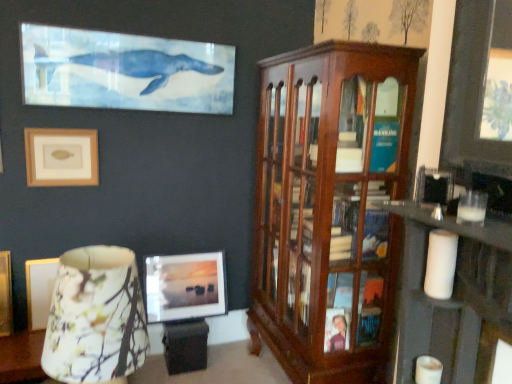
You are a GUI agent. You are given a task and a screenshot of the screen. Output one action in this format:
    pyautogui.click(x=<x>, y=<y>)
    Task: Click on the blank space above floral fabric lampshade at lower left (from a real-world perspective)
    The height and width of the screenshot is (384, 512).
    Given the screenshot: What is the action you would take?
    pyautogui.click(x=92, y=264)